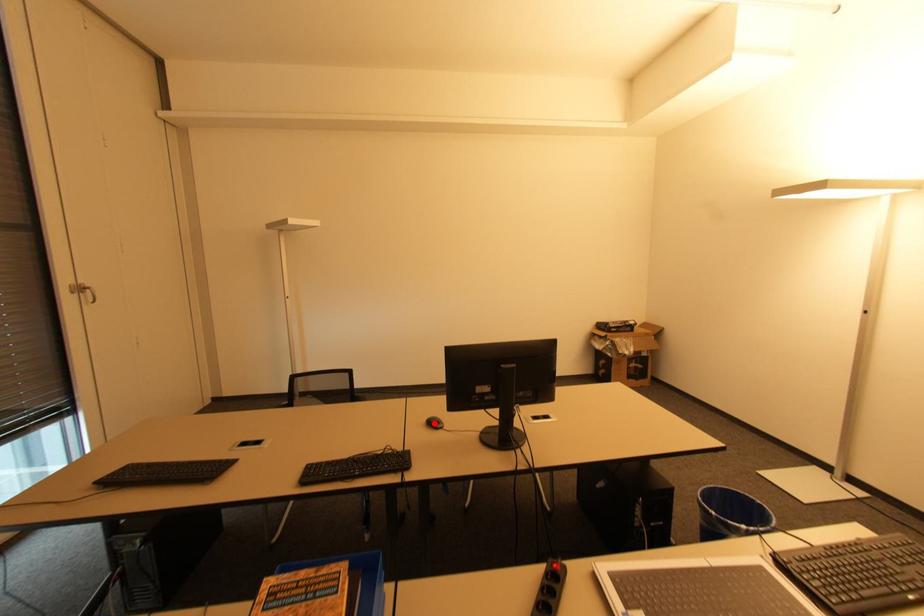
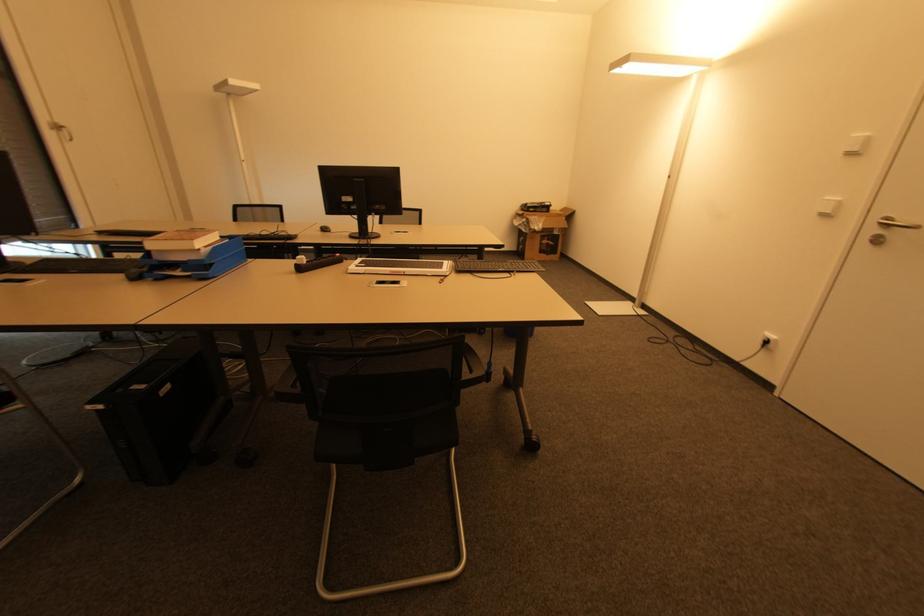
Locate, in the second image, the point that corresponds to the highlighted location in the first image.

(325, 230)